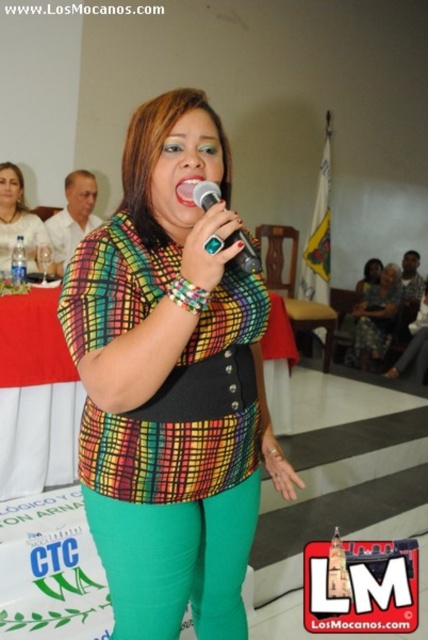
Question: Which point appears closest to the camera in this image?

Choices:
 (A) (20, 200)
 (B) (255, 250)

Answer: (B)

Question: Which is nearer to the pink glossy lips at center?

Choices:
 (A) teal plastic microphone at center
 (B) printed fabric dress at center

Answer: (A)

Question: Can you confirm if multicolored woven blouse at center is wider than printed fabric dress at center?

Choices:
 (A) yes
 (B) no

Answer: (B)

Question: Which object appears farthest from the camera in this image?

Choices:
 (A) teal plastic microphone at center
 (B) printed fabric dress at center

Answer: (B)

Question: Can you confirm if teal plastic microphone at center is bigger than pink glossy lips at center?

Choices:
 (A) yes
 (B) no

Answer: (A)

Question: Does multicolored woven blouse at center have a smaller size compared to pink glossy lips at center?

Choices:
 (A) yes
 (B) no

Answer: (B)